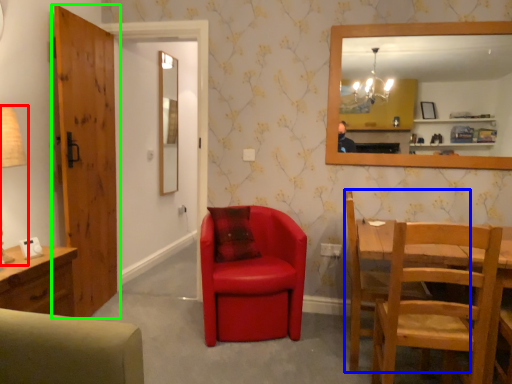
Question: Considering the real-world distances, which object is closest to table lamp (highlighted by a red box)? chair (highlighted by a blue box) or door (highlighted by a green box).

Choices:
 (A) chair
 (B) door

Answer: (B)